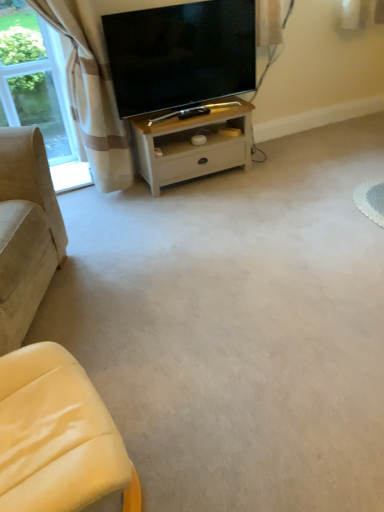
You are a GUI agent. You are given a task and a screenshot of the screen. Output one action in this format:
    pyautogui.click(x=<x>, y=<y>)
    Task: Click on the free space to the right of beige plaid curtain at upper left
    The image size is (384, 512).
    Given the screenshot: What is the action you would take?
    pyautogui.click(x=148, y=206)